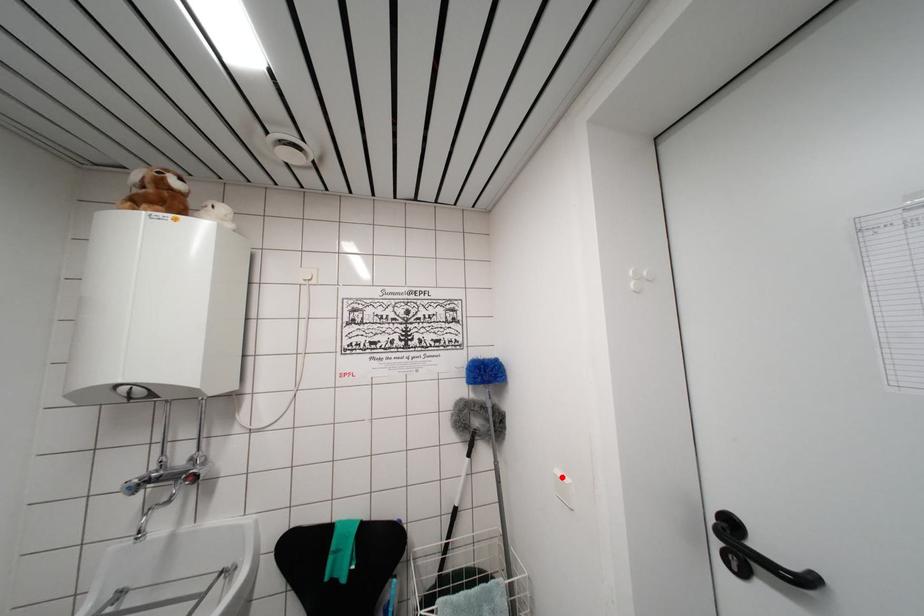
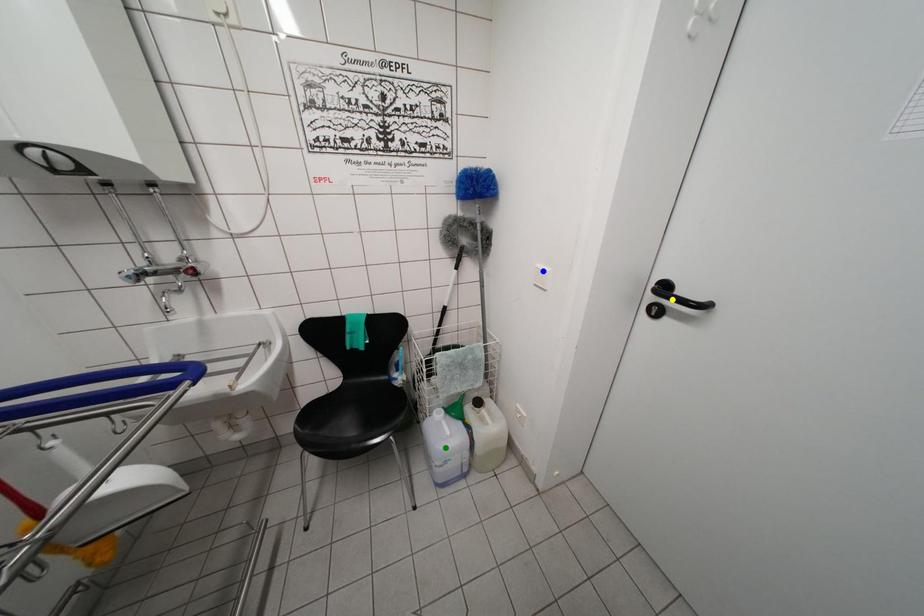
Question: I am providing you with two images of the same scene from different viewpoints. A red point is marked on the first image. You are given multiple points on the second image. Which mark in image 2 goes with the point in image 1?

Choices:
 (A) yellow point
 (B) blue point
 (C) green point

Answer: (B)